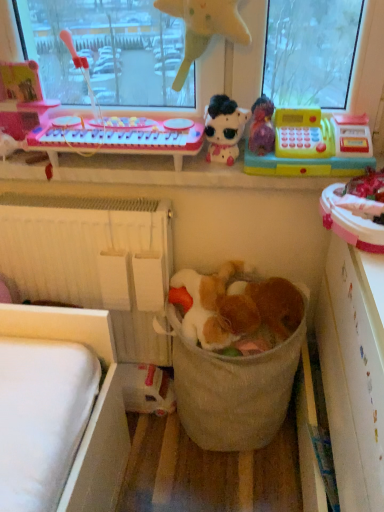
Question: Is pink plastic keyboard at upper left wider than shiny plastic toy piano at upper left, which is the 1th toy in left-to-right order?

Choices:
 (A) yes
 (B) no

Answer: (A)

Question: Is pink plastic keyboard at upper left positioned beyond the bounds of shiny plastic toy piano at upper left, which is the 5th toy in right-to-left order?

Choices:
 (A) no
 (B) yes

Answer: (B)

Question: Does pink plastic keyboard at upper left come behind shiny plastic toy piano at upper left, which is the 5th toy in right-to-left order?

Choices:
 (A) no
 (B) yes

Answer: (A)

Question: Can you confirm if pink plastic keyboard at upper left is bigger than shiny plastic toy piano at upper left, which is the 5th toy in right-to-left order?

Choices:
 (A) no
 (B) yes

Answer: (B)

Question: From the image's perspective, is pink plastic keyboard at upper left over shiny plastic toy piano at upper left, the 4th toy positioned from the bottom?

Choices:
 (A) no
 (B) yes

Answer: (A)

Question: From a real-world perspective, does pink plastic keyboard at upper left stand above shiny plastic toy piano at upper left, the 4th toy positioned from the bottom?

Choices:
 (A) no
 (B) yes

Answer: (A)

Question: From the image's perspective, would you say fuzzy fabric stuffed animal at center, positioned as the fifth toy in top-to-bottom order, is positioned over pink plastic keyboard at upper left?

Choices:
 (A) yes
 (B) no

Answer: (B)

Question: Is fuzzy fabric stuffed animal at center, which is the 2th toy in right-to-left order, smaller than pink plastic keyboard at upper left?

Choices:
 (A) yes
 (B) no

Answer: (A)

Question: Is the surface of fuzzy fabric stuffed animal at center, positioned as the 4th toy in left-to-right order, in direct contact with pink plastic keyboard at upper left?

Choices:
 (A) no
 (B) yes

Answer: (A)

Question: From a real-world perspective, is fuzzy fabric stuffed animal at center, which appears as the first toy when ordered from the bottom, on pink plastic keyboard at upper left?

Choices:
 (A) no
 (B) yes

Answer: (A)

Question: Does fuzzy fabric stuffed animal at center, which is the 2th toy in right-to-left order, come behind pink plastic keyboard at upper left?

Choices:
 (A) yes
 (B) no

Answer: (B)

Question: Is fuzzy fabric stuffed animal at center, which is the 2th toy in right-to-left order, aimed at pink plastic keyboard at upper left?

Choices:
 (A) yes
 (B) no

Answer: (B)

Question: From the image's perspective, is shiny plastic toy piano at upper left, the 4th toy positioned from the bottom, above white textured radiator at lower left?

Choices:
 (A) yes
 (B) no

Answer: (A)